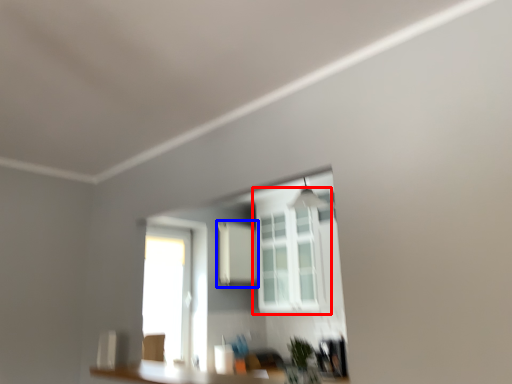
Question: Which object appears farthest to the camera in this image, window (highlighted by a red box) or medicine cabinet (highlighted by a blue box)?

Choices:
 (A) window
 (B) medicine cabinet

Answer: (B)